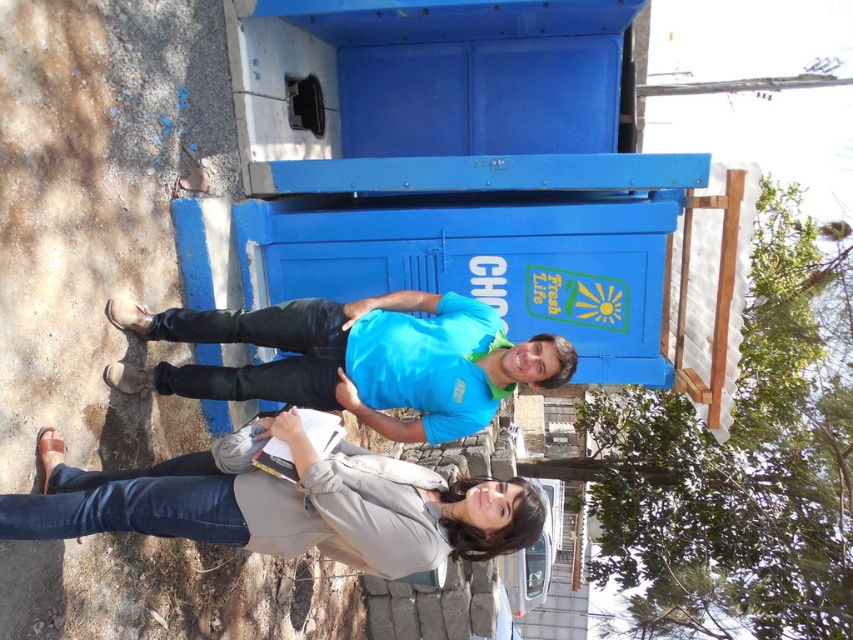
Which is more to the left, light gray fabric jacket at lower center or matte blue shirt at center?

From the viewer's perspective, light gray fabric jacket at lower center appears more on the left side.

Between point (306, 474) and point (445, 384), which one is positioned behind?

Point (445, 384)

Identify the location of light gray fabric jacket at lower center. (286, 506).